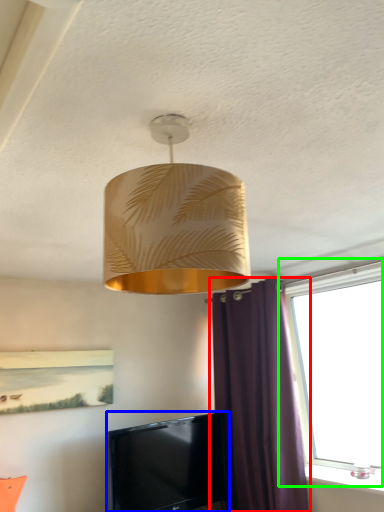
Question: Which is farther away from curtain (highlighted by a red box)? television (highlighted by a blue box) or window (highlighted by a green box)?

Choices:
 (A) television
 (B) window

Answer: (A)